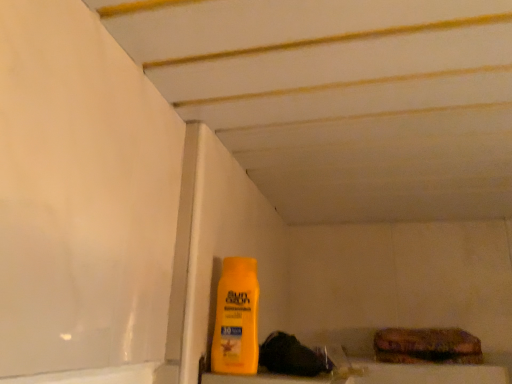
Question: Is textured brown bread at lower right bigger than yellow matte bottle at center?

Choices:
 (A) no
 (B) yes

Answer: (B)

Question: Can you confirm if textured brown bread at lower right is smaller than yellow matte bottle at center?

Choices:
 (A) no
 (B) yes

Answer: (A)

Question: Is the depth of textured brown bread at lower right less than that of yellow matte bottle at center?

Choices:
 (A) yes
 (B) no

Answer: (B)

Question: Is textured brown bread at lower right positioned with its back to yellow matte bottle at center?

Choices:
 (A) yes
 (B) no

Answer: (B)

Question: From a real-world perspective, is textured brown bread at lower right positioned under yellow matte bottle at center based on gravity?

Choices:
 (A) yes
 (B) no

Answer: (A)

Question: Is textured brown bread at lower right thinner than yellow matte bottle at center?

Choices:
 (A) yes
 (B) no

Answer: (B)

Question: Considering the relative positions of yellow matte bottle at center and textured brown bread at lower right in the image provided, is yellow matte bottle at center behind textured brown bread at lower right?

Choices:
 (A) no
 (B) yes

Answer: (A)

Question: Is yellow matte bottle at center closer to the viewer compared to textured brown bread at lower right?

Choices:
 (A) yes
 (B) no

Answer: (A)

Question: Is textured brown bread at lower right located within yellow matte bottle at center?

Choices:
 (A) no
 (B) yes

Answer: (A)

Question: From a real-world perspective, is yellow matte bottle at center positioned over textured brown bread at lower right based on gravity?

Choices:
 (A) no
 (B) yes

Answer: (B)

Question: Is yellow matte bottle at center at the right side of textured brown bread at lower right?

Choices:
 (A) yes
 (B) no

Answer: (B)

Question: Is yellow matte bottle at center next to textured brown bread at lower right?

Choices:
 (A) no
 (B) yes

Answer: (A)

Question: Is yellow matte bottle at center wider or thinner than textured brown bread at lower right?

Choices:
 (A) thin
 (B) wide

Answer: (A)